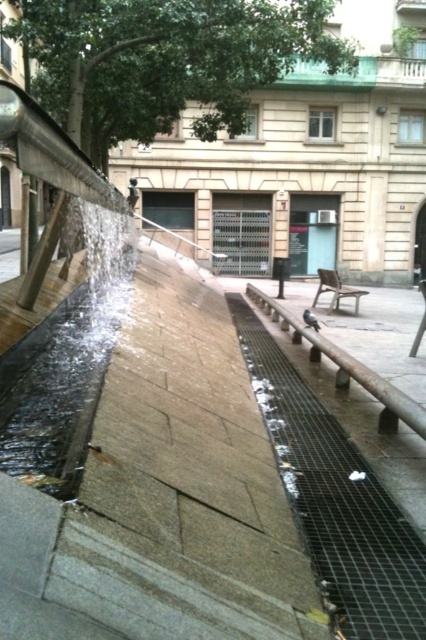
Can you confirm if clear glass water at left is bigger than brown wooden rail at center?

Yes, clear glass water at left is bigger than brown wooden rail at center.

Does point (60, 424) come farther from viewer compared to point (270, 317)?

No, (60, 424) is in front of (270, 317).

Locate an element on the screen. The image size is (426, 640). clear glass water at left is located at coordinates (66, 365).

Is clear glass water at left taller than wooden park bench at center?

Yes.

Is clear glass water at left bigger than wooden park bench at center?

Yes.

Does point (89, 280) come farther from viewer compared to point (311, 307)?

No, (89, 280) is closer to viewer.

Where is `clear glass water at left`? The width and height of the screenshot is (426, 640). clear glass water at left is located at coordinates (66, 365).

Who is lower down, brown wooden rail at center or wooden park bench at center?

brown wooden rail at center

Does brown wooden rail at center have a larger size compared to wooden park bench at center?

Actually, brown wooden rail at center might be smaller than wooden park bench at center.

This screenshot has width=426, height=640. In order to click on brown wooden rail at center in this screenshot , I will do [x=347, y=369].